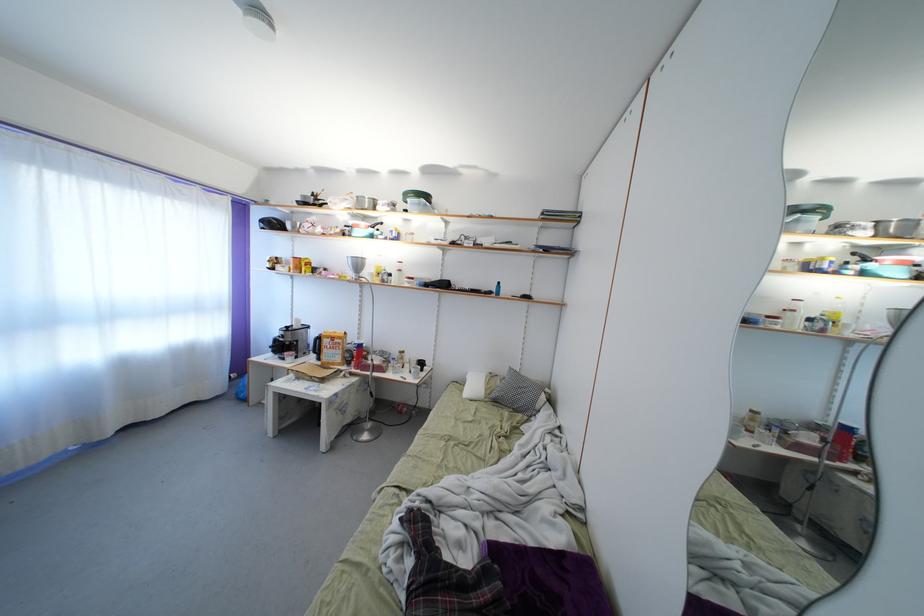
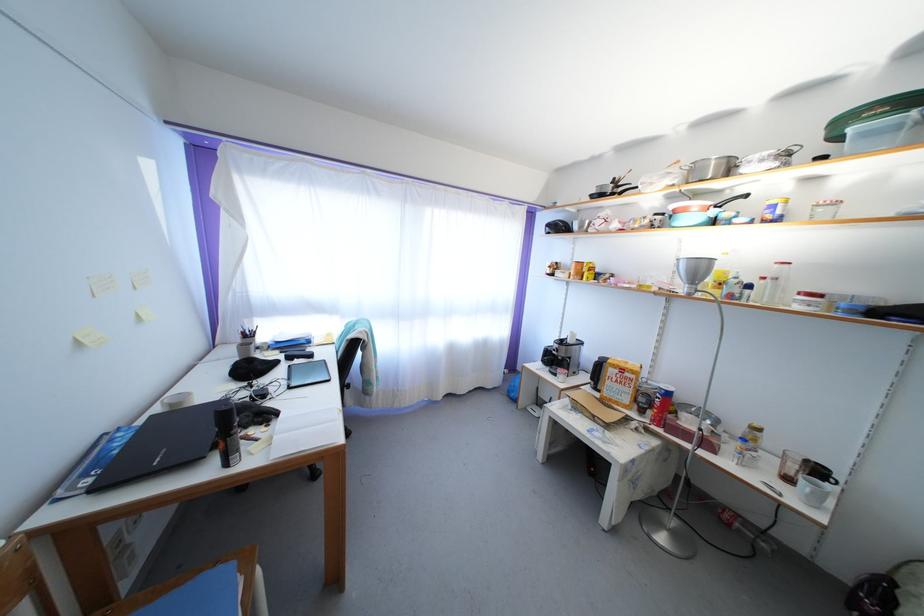
Question: The first image is from the beginning of the video and the second image is from the end. How did the camera likely rotate when shooting the video?

Choices:
 (A) Left
 (B) Right
 (C) Up
 (D) Down

Answer: (A)